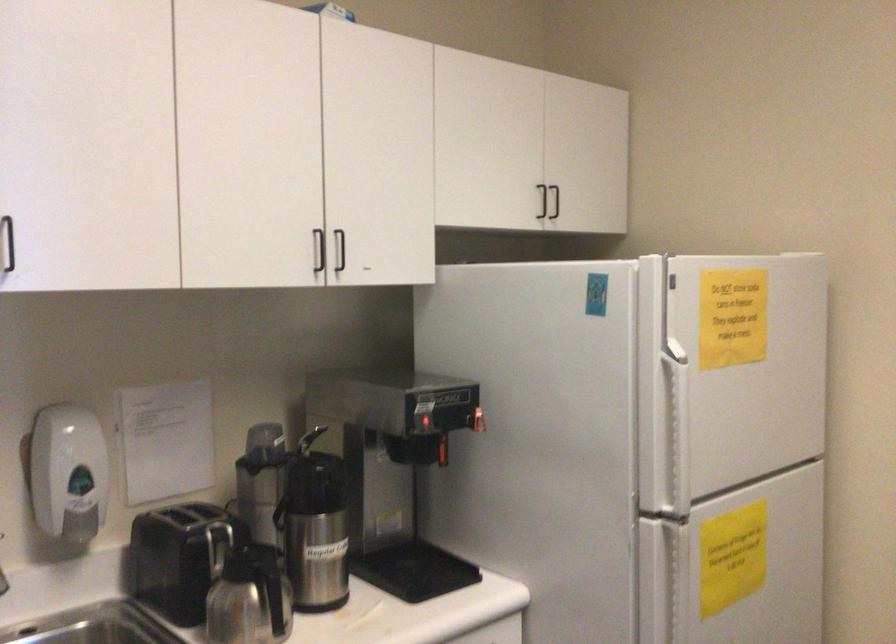
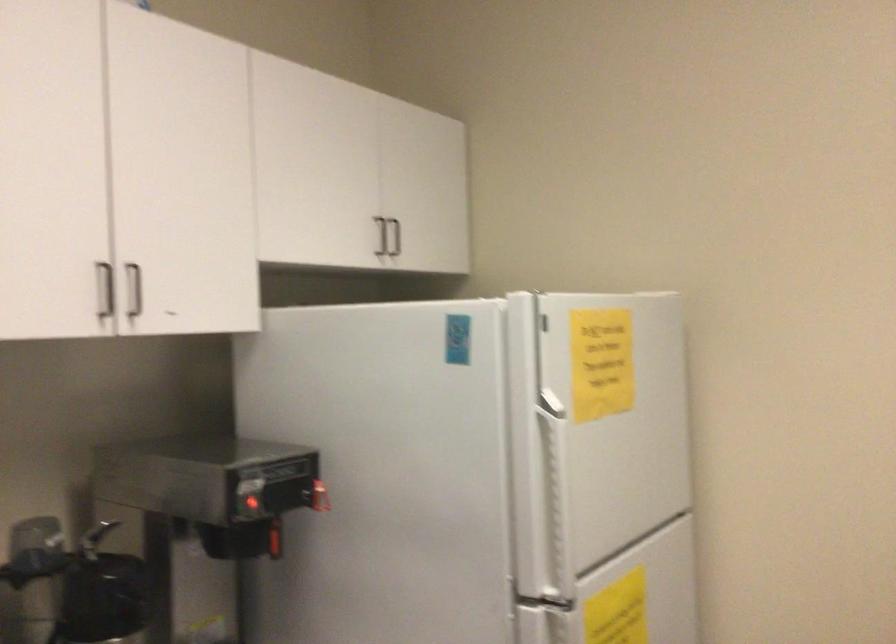
The point at (739, 538) is marked in the first image. Where is the corresponding point in the second image?

(617, 611)